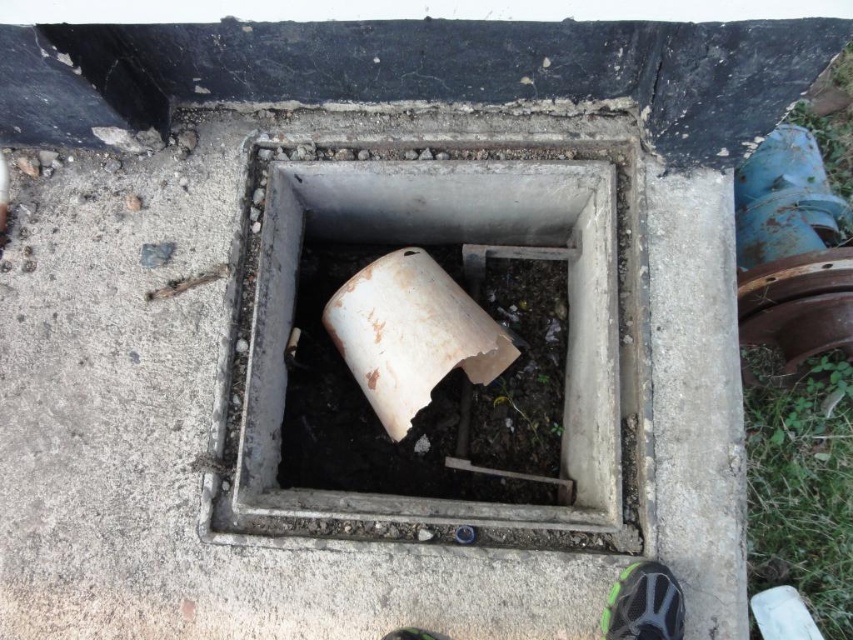
Question: Does green fabric shoe at lower right have a larger size compared to green matte shoe at lower center?

Choices:
 (A) no
 (B) yes

Answer: (B)

Question: Among these objects, which one is nearest to the camera?

Choices:
 (A) white matte pipe at center
 (B) green matte shoe at lower center
 (C) white matte cement at center
 (D) green fabric shoe at lower right

Answer: (D)

Question: Which point is farther from the camera taking this photo?

Choices:
 (A) (350, 209)
 (B) (73, 545)
 (C) (424, 634)

Answer: (A)

Question: Is white matte cement at center bigger than green matte shoe at lower center?

Choices:
 (A) no
 (B) yes

Answer: (B)

Question: Does white matte cement at center have a larger size compared to green fabric shoe at lower right?

Choices:
 (A) yes
 (B) no

Answer: (A)

Question: Which point is closer to the camera?

Choices:
 (A) green matte shoe at lower center
 (B) green fabric shoe at lower right

Answer: (B)